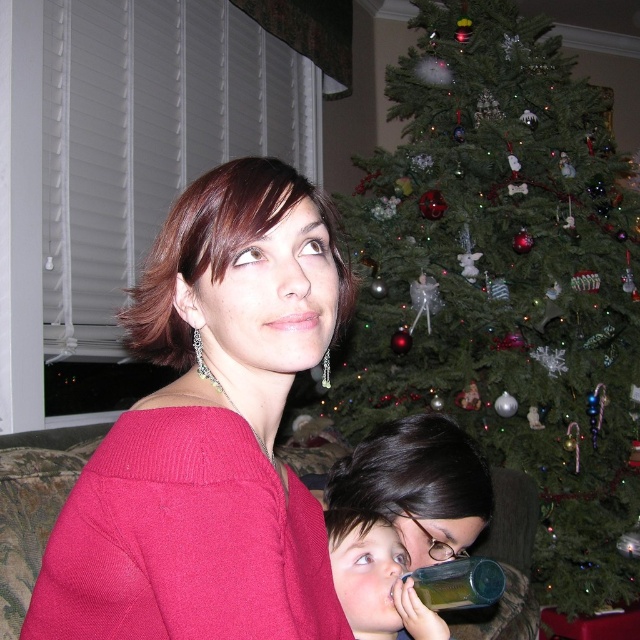
You are a visitor at a holiday party and want to place a 1.5 foot tall decoration on either the green matte christmas tree at upper center or the smooth plastic bottle at lower center. Based on their sizes, which object would be more stable for the decoration?

The green matte christmas tree at upper center has a greater height compared to the smooth plastic bottle at lower center, so placing the decoration on the green matte christmas tree at upper center would be more stable since it is taller and likely has a broader base.

Based on the scene description, where is the green matte christmas tree at upper center located in terms of its 2D coordinates?

The green matte christmas tree at upper center is located at the 2D coordinates of point (506, 280).